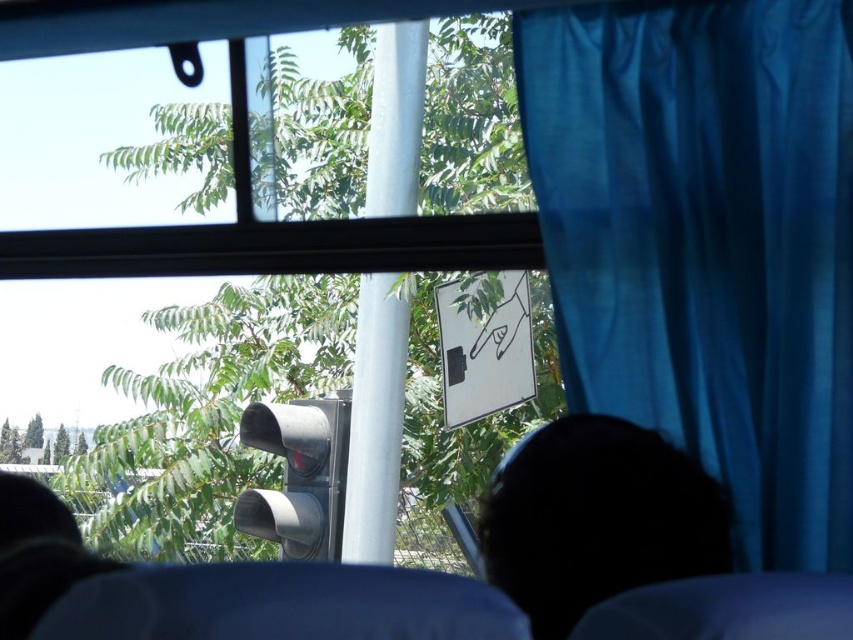
Does blue fabric curtain at right appear over metallic gray traffic light at center?

Correct, blue fabric curtain at right is located above metallic gray traffic light at center.

Can you confirm if blue fabric curtain at right is wider than metallic gray traffic light at center?

Correct, the width of blue fabric curtain at right exceeds that of metallic gray traffic light at center.

You are a GUI agent. You are given a task and a screenshot of the screen. Output one action in this format:
    pyautogui.click(x=<x>, y=<y>)
    Task: Click on the blue fabric curtain at right
    This screenshot has height=640, width=853.
    Given the screenshot: What is the action you would take?
    tap(706, 243)

Where is `blue fabric curtain at right`? blue fabric curtain at right is located at coordinates (706, 243).

What do you see at coordinates (596, 518) in the screenshot?
I see `black matte head at lower center` at bounding box center [596, 518].

The image size is (853, 640). Describe the element at coordinates (596, 518) in the screenshot. I see `black matte head at lower center` at that location.

In order to click on black matte head at lower center in this screenshot , I will do (596, 518).

Does point (804, 88) come behind point (724, 509)?

Yes, point (804, 88) is behind point (724, 509).

Identify the location of blue fabric curtain at right. (706, 243).